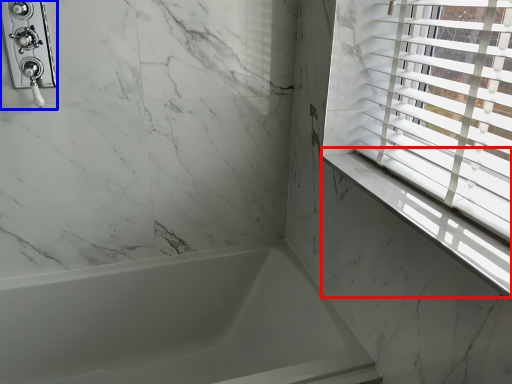
Question: Among these objects, which one is farthest to the camera, window sill (highlighted by a red box) or shower (highlighted by a blue box)?

Choices:
 (A) window sill
 (B) shower

Answer: (B)